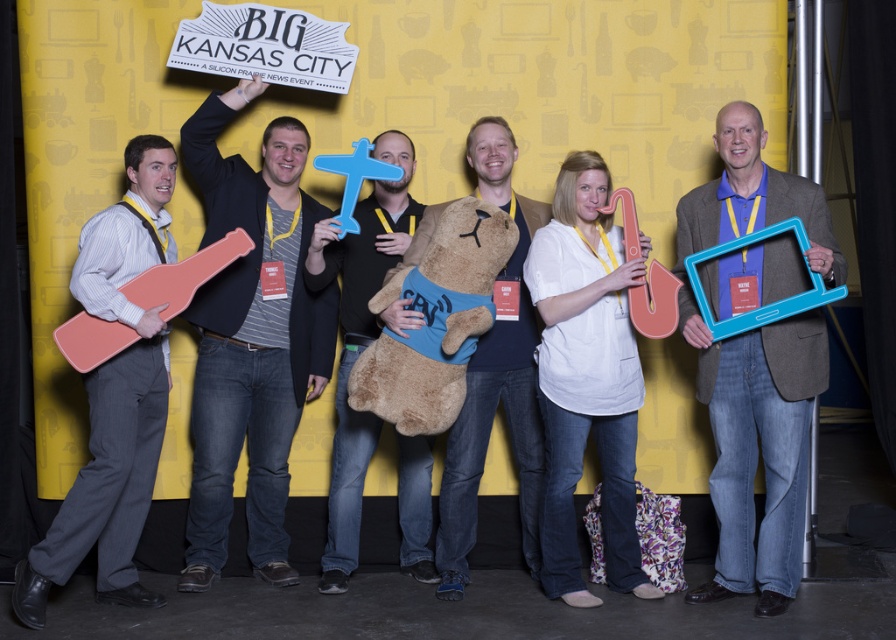
Question: Estimate the real-world distances between objects in this image. Which object is farther from the brushed wood guitar at left?

Choices:
 (A) blue plastic frame at center
 (B) soft plush teddy bear at center

Answer: (A)

Question: In this image, where is brushed wood guitar at left located relative to soft plush teddy bear at center?

Choices:
 (A) above
 (B) below

Answer: (B)

Question: Which object is closer to the camera taking this photo?

Choices:
 (A) brushed wood guitar at left
 (B) soft plush teddy bear at center
 (C) soft plush bear at center

Answer: (A)

Question: Which of the following is the farthest from the observer?

Choices:
 (A) soft plush bear at center
 (B) striped cotton shirt at center
 (C) soft plush teddy bear at center

Answer: (A)

Question: Can you confirm if striped cotton shirt at center is wider than brushed wood guitar at left?

Choices:
 (A) yes
 (B) no

Answer: (A)

Question: Does brushed wood guitar at left come in front of soft plush teddy bear at center?

Choices:
 (A) yes
 (B) no

Answer: (A)